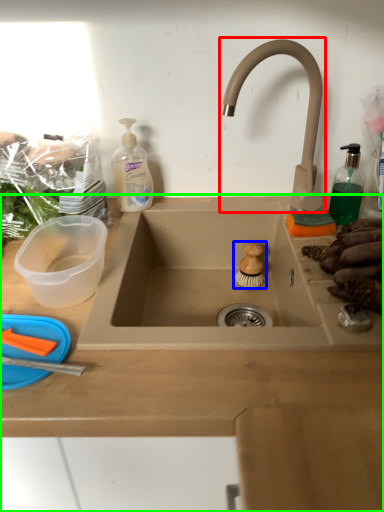
Question: Which is farther away from tap (highlighted by a red box)? food (highlighted by a blue box) or countertop (highlighted by a green box)?

Choices:
 (A) food
 (B) countertop

Answer: (B)